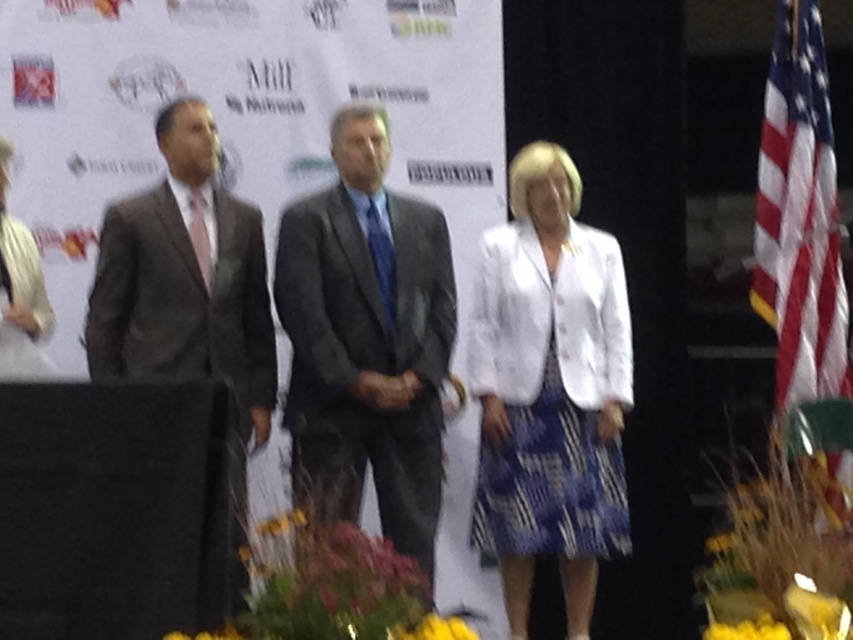
Is american flag at right above yellow fabric flower at lower center?

Yes, american flag at right is above yellow fabric flower at lower center.

Can you confirm if american flag at right is positioned to the right of yellow fabric flower at lower center?

Indeed, american flag at right is positioned on the right side of yellow fabric flower at lower center.

Where is `american flag at right`? The width and height of the screenshot is (853, 640). american flag at right is located at coordinates (799, 216).

The height and width of the screenshot is (640, 853). I want to click on american flag at right, so click(x=799, y=216).

Who is taller, white textured blazer at center or dark gray suit at center?

white textured blazer at center is taller.

Does white textured blazer at center have a greater height compared to dark gray suit at center?

Yes.

Which is in front, point (511, 424) or point (392, 282)?

Positioned in front is point (392, 282).

Where is `white textured blazer at center`? white textured blazer at center is located at coordinates (549, 388).

Who is taller, dark gray suit at center or dark gray textured suit at left?

With more height is dark gray suit at center.

Is dark gray suit at center thinner than dark gray textured suit at left?

No, dark gray suit at center is not thinner than dark gray textured suit at left.

Measure the distance between point (369, 339) and camera.

Point (369, 339) is 5.10 meters from camera.

Find the location of a particular element. Image resolution: width=853 pixels, height=640 pixels. dark gray suit at center is located at coordinates (366, 339).